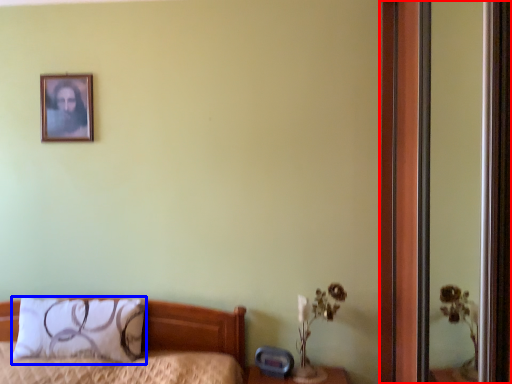
Question: Among these objects, which one is farthest to the camera, screen door (highlighted by a red box) or pillow (highlighted by a blue box)?

Choices:
 (A) screen door
 (B) pillow

Answer: (B)